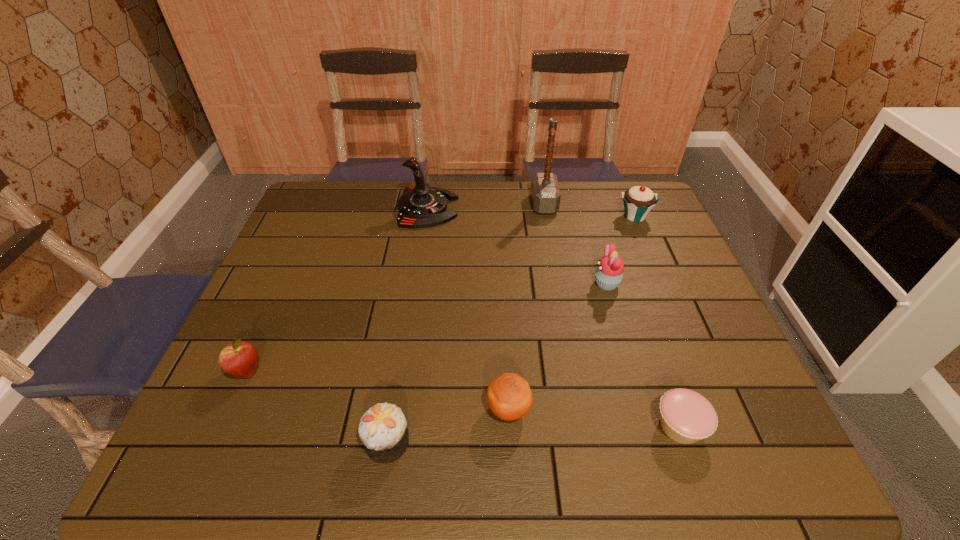
Locate an element on the screen. the tallest object is located at coordinates (545, 192).

You are a GUI agent. You are given a task and a screenshot of the screen. Output one action in this format:
    pyautogui.click(x=<x>, y=<y>)
    Task: Click on the fourth object from right to left
    Image resolution: width=960 pixels, height=540 pixels.
    Given the screenshot: What is the action you would take?
    [x=545, y=192]

Locate an element on the screen. The image size is (960, 540). joystick is located at coordinates (420, 206).

Locate an element on the screen. This screenshot has height=540, width=960. the farthest cupcake is located at coordinates (638, 201).

This screenshot has width=960, height=540. Find the location of `the fourth farthest object`. the fourth farthest object is located at coordinates (609, 273).

Locate an element on the screen. The height and width of the screenshot is (540, 960). apple is located at coordinates (240, 359).

In order to click on the fourth nearest object in this screenshot , I will do pyautogui.click(x=240, y=359).

This screenshot has height=540, width=960. Identify the location of the fourth object from left to right. (509, 396).

Where is `the second shortest cupcake`? This screenshot has width=960, height=540. the second shortest cupcake is located at coordinates (383, 429).

You are a GUI agent. You are given a task and a screenshot of the screen. Output one action in this format:
    pyautogui.click(x=<x>, y=<y>)
    Task: Click on the shortest cupcake
    The image size is (960, 540).
    Given the screenshot: What is the action you would take?
    pyautogui.click(x=686, y=417)